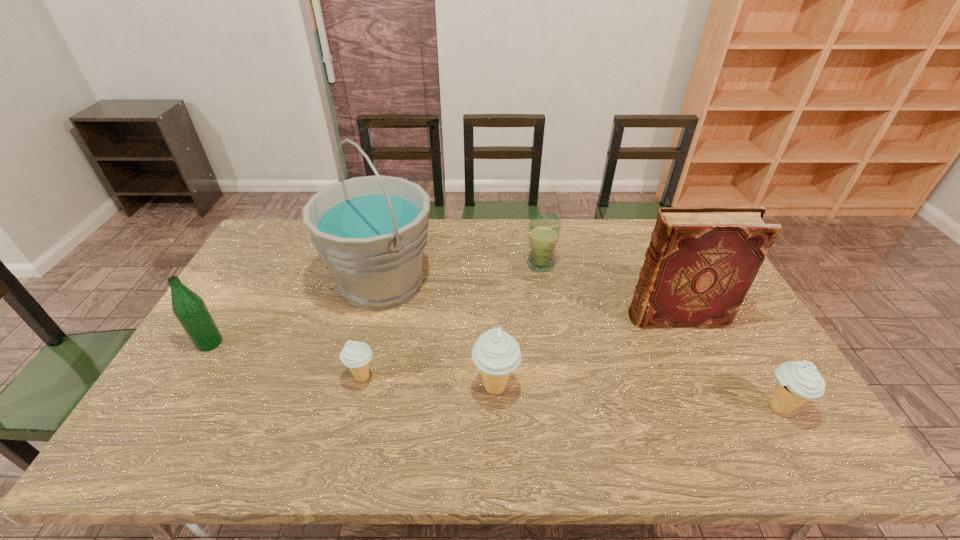
Where is `free space located 0.220m on the right of the shortest icecream`? free space located 0.220m on the right of the shortest icecream is located at coordinates (462, 377).

Where is `vacant space positioned 0.120m on the back of the fourth object from left to right`? This screenshot has height=540, width=960. vacant space positioned 0.120m on the back of the fourth object from left to right is located at coordinates (493, 334).

The image size is (960, 540). I want to click on vacant position located 0.210m on the left of the rightmost icecream, so click(x=673, y=408).

At what (x,y) coordinates should I click in order to perform the action: click on free region located 0.170m on the left of the glass. Please return your answer as a coordinate pair (x, y). This screenshot has width=960, height=540. Looking at the image, I should click on (475, 265).

Locate an element on the screen. Image resolution: width=960 pixels, height=540 pixels. blank space located on the front of the bucket is located at coordinates (362, 360).

In order to click on free location located 0.280m on the back of the leftmost object in this screenshot , I will do (x=253, y=271).

What are the coordinates of `free location located 0.390m on the spine side of the sixth shortest object` in the screenshot? It's located at (498, 317).

Identify the location of free location located 0.360m on the spine side of the sixth shortest object. (508, 317).

Find the location of a particular element. The height and width of the screenshot is (540, 960). free space located 0.050m on the spine side of the sixth shortest object is located at coordinates (612, 317).

I want to click on glass that is positioned at the far edge, so click(544, 228).